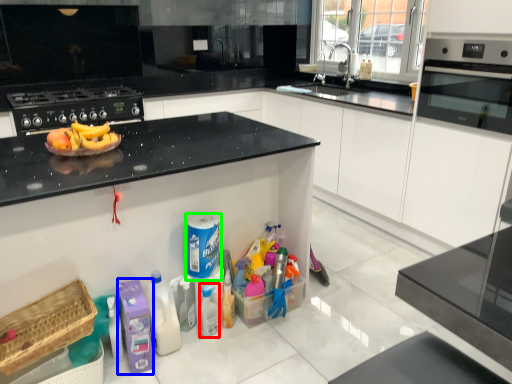
Question: Which is farther away from bottle (highlighted by a red box)? cleaning product (highlighted by a blue box) or cleaning product (highlighted by a green box)?

Choices:
 (A) cleaning product
 (B) cleaning product

Answer: (A)